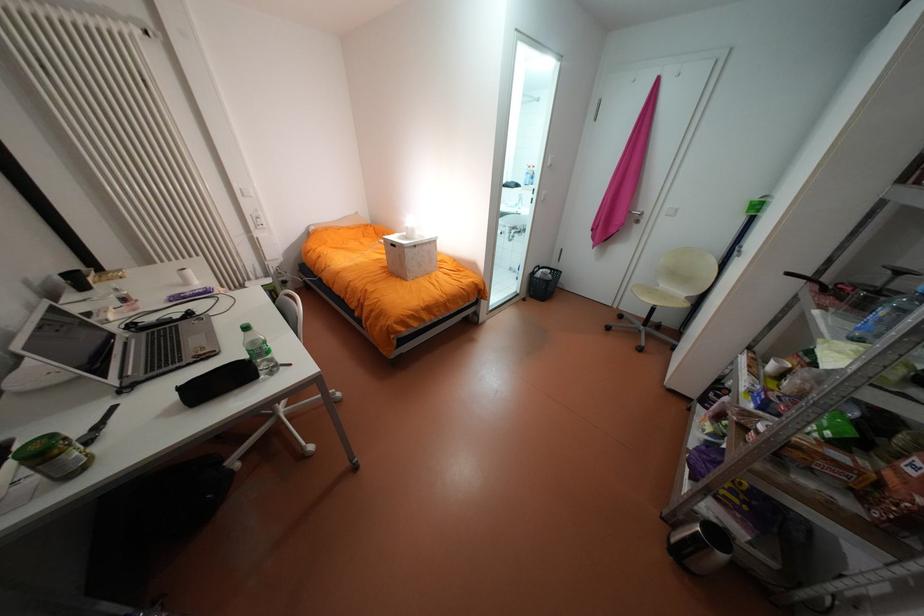
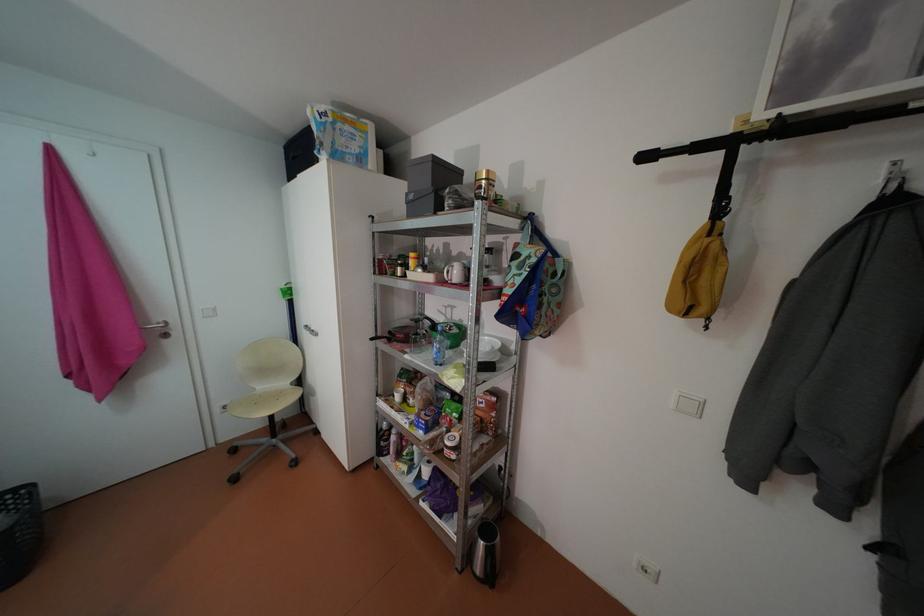
Question: Based on the continuous images, in which direction is the camera rotating? Reply with the corresponding letter.

Choices:
 (A) Left
 (B) Right
 (C) Up
 (D) Down

Answer: (B)